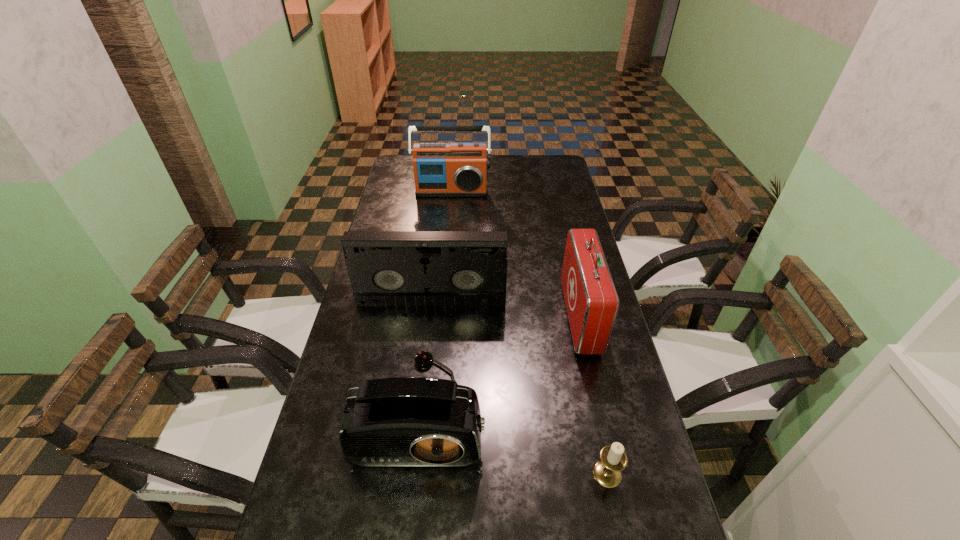
Locate an element on the screen. The width and height of the screenshot is (960, 540). vacant space located 0.260m on the front side of the videotape is located at coordinates (422, 376).

The image size is (960, 540). Find the location of `vacant area located 0.080m on the front-facing side of the shorter radio receiver`. vacant area located 0.080m on the front-facing side of the shorter radio receiver is located at coordinates (411, 511).

In order to click on free location located 0.310m on the back of the candle holder in this screenshot , I will do click(581, 352).

This screenshot has height=540, width=960. I want to click on videotape that is at the left edge, so click(x=386, y=268).

Identify the location of the first-aid kit at the right edge. This screenshot has height=540, width=960. point(591,299).

Find the location of a particular element. candle holder located at the right edge is located at coordinates (607, 472).

In the image, there is a desktop. Where is `vacant space at the far edge`? vacant space at the far edge is located at coordinates (515, 169).

Locate an element on the screen. This screenshot has height=540, width=960. vacant region at the left edge of the desktop is located at coordinates (384, 353).

I want to click on vacant position at the right edge of the desktop, so click(667, 519).

Where is `free space between the shortest object and the farthest object`? This screenshot has height=540, width=960. free space between the shortest object and the farthest object is located at coordinates (529, 333).